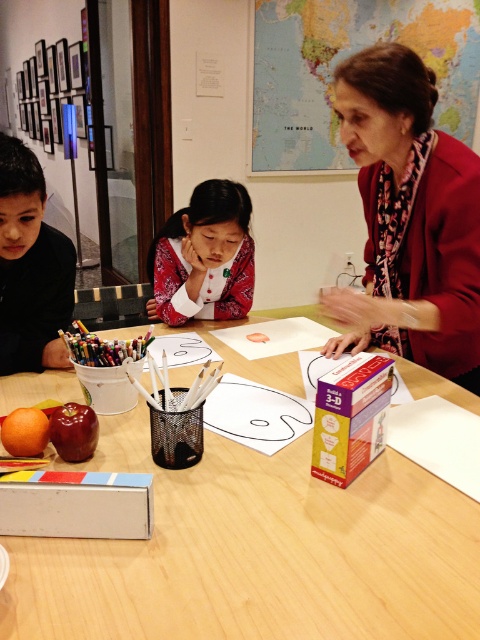
Is black matte boy at left positioned at the back of matte pink blouse at center?

No, it is in front of matte pink blouse at center.

Is black matte boy at left bigger than matte pink blouse at center?

No.

Which is behind, point (60, 305) or point (228, 205)?

Point (60, 305)

At what (x,y) coordinates should I click in order to perform the action: click on black matte boy at left. Please return your answer as a coordinate pair (x, y). Looking at the image, I should click on (31, 268).

Which is below, white cardboard box at lower left or multicolored wax crayons at lower left?

white cardboard box at lower left is below.

Between point (43, 499) and point (74, 349), which one is positioned behind?

The point (74, 349) is behind.

Does point (33, 497) come behind point (83, 328)?

No.

Locate an element on the screen. The image size is (480, 640). white cardboard box at lower left is located at coordinates (75, 504).

Is the position of wooden table at center more distant than that of matte pink blouse at center?

That is False.

Who is lower down, wooden table at center or matte pink blouse at center?

wooden table at center is below.

This screenshot has height=640, width=480. What do you see at coordinates (255, 554) in the screenshot?
I see `wooden table at center` at bounding box center [255, 554].

Find the location of a particular element. Image resolution: width=480 pixels, height=640 pixels. wooden table at center is located at coordinates (255, 554).